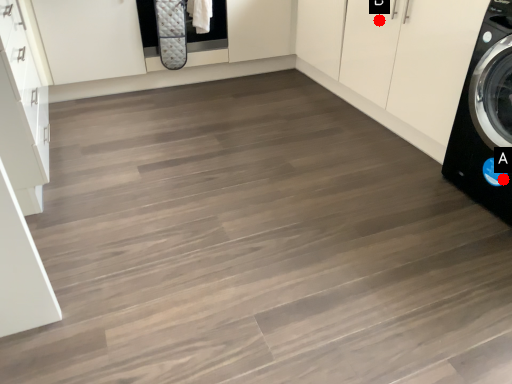
Question: Two points are circled on the image, labeled by A and B beside each circle. Which point appears closest to the camera in this image?

Choices:
 (A) A is closer
 (B) B is closer

Answer: (A)